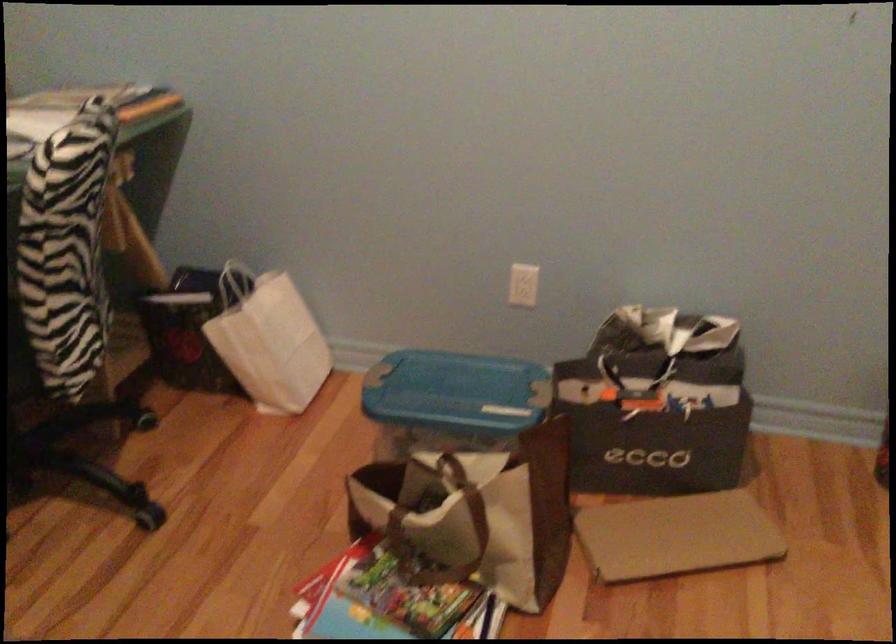
Where is `white bag handle`? white bag handle is located at coordinates (236, 281).